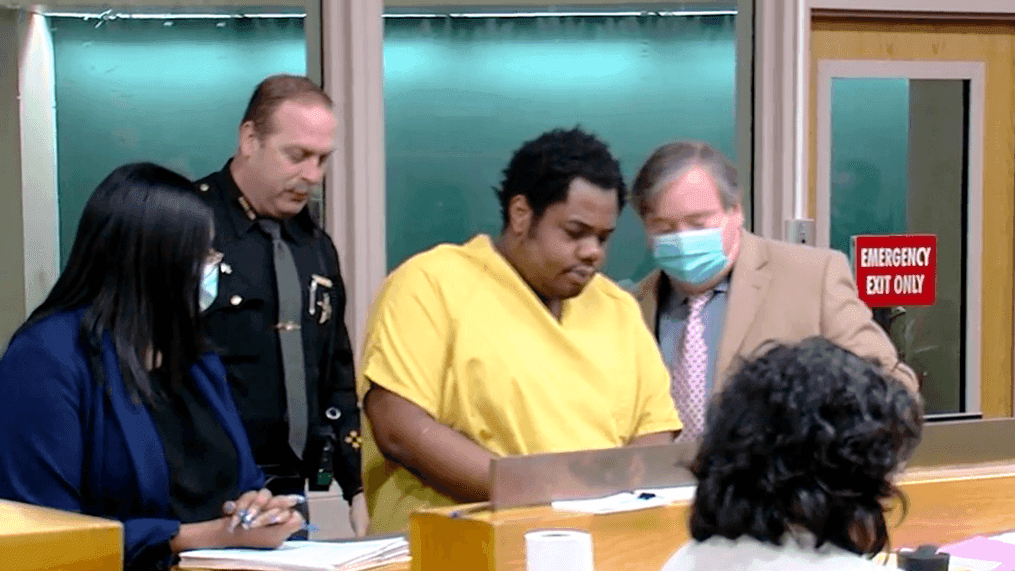
Find the location of `stack of papers`. stack of papers is located at coordinates (345, 544).